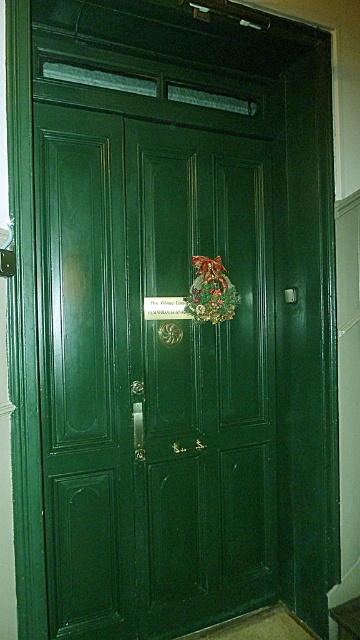
You are a delivery person trying to deliver a package to the address on the nameplate. The package is too large to fit through the mail slot. You need to know if you can reach the doorknob without moving the wreath. Can you determine if the green polished wood door at center is taller than the green fabric wreath at center?

The green polished wood door at center is taller than the green fabric wreath at center, so yes, you can reach the doorknob without moving the wreath because the door is taller and the wreath is placed on the right side, not blocking the doorknob area.

You are a delivery person trying to deliver a package to the address on the nameplate. You need to see the nameplate clearly to confirm the address. Which object should you look at first, the green polished wood door at center or the green fabric wreath at center?

You should look at the green polished wood door at center first because it is below the green fabric wreath at center, so it is closer to you.

You are standing in front of the green polished wood door at center and want to touch the green fabric wreath at center. Which direction should you move to reach it?

Since the green polished wood door at center is closer to you than the green fabric wreath at center, you should move forward to reach the wreath.